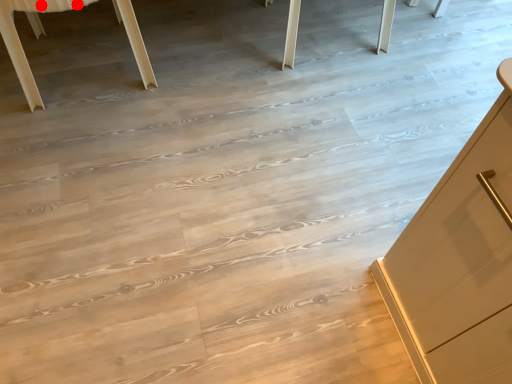
Question: Two points are circled on the image, labeled by A and B beside each circle. Which point is closer to the camera taking this photo?

Choices:
 (A) A is closer
 (B) B is closer

Answer: (A)